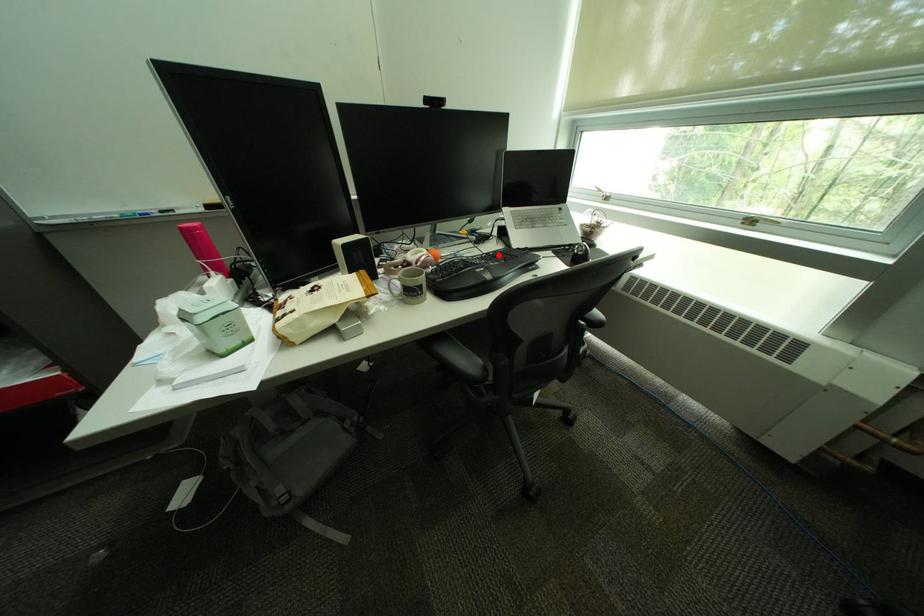
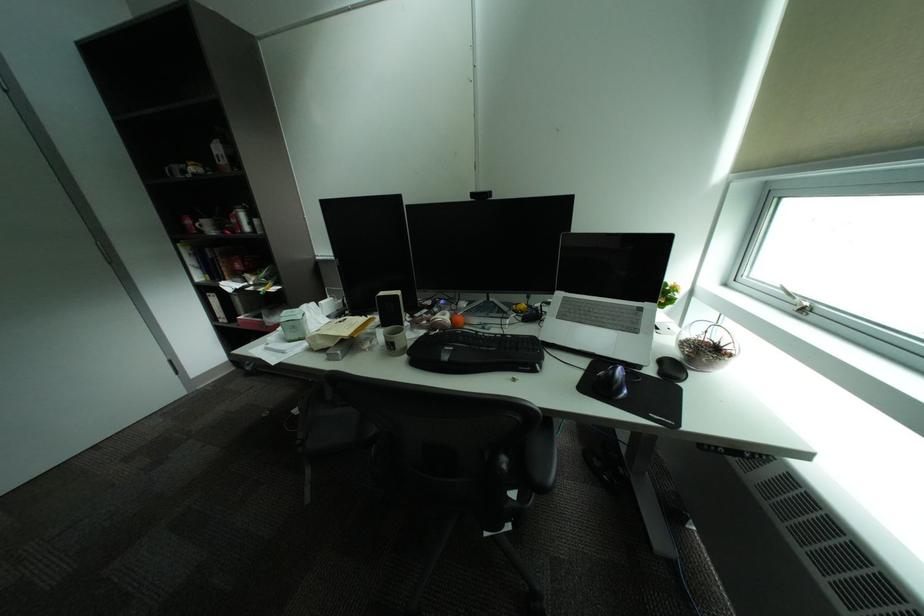
Find the pixel in the second image that matches the highlighted location in the first image.

(516, 336)